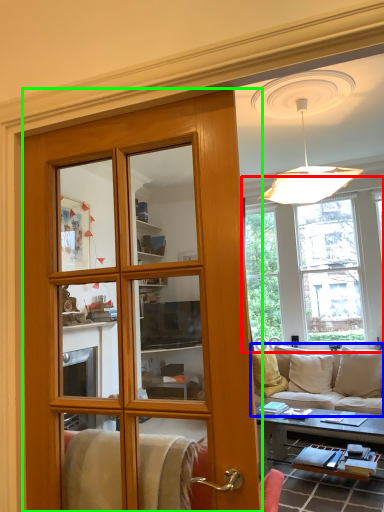
Question: Which object is positioned closest to window (highlighted by a red box)? Select from studio couch (highlighted by a blue box) and door (highlighted by a green box).

Choices:
 (A) studio couch
 (B) door

Answer: (A)